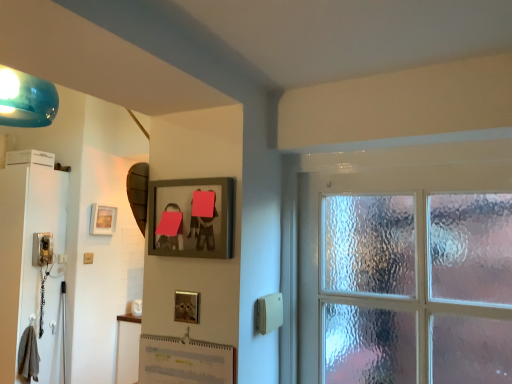
Question: Can you confirm if matte black phone at left is positioned to the left of matte white light switch at lower left?

Choices:
 (A) yes
 (B) no

Answer: (A)

Question: Does matte black phone at left have a smaller size compared to matte white light switch at lower left?

Choices:
 (A) yes
 (B) no

Answer: (B)

Question: From the image's perspective, is matte black phone at left over matte white light switch at lower left?

Choices:
 (A) yes
 (B) no

Answer: (A)

Question: Is matte black phone at left outside matte white light switch at lower left?

Choices:
 (A) no
 (B) yes

Answer: (B)

Question: Can you confirm if matte black phone at left is shorter than matte white light switch at lower left?

Choices:
 (A) no
 (B) yes

Answer: (A)

Question: Is matte black phone at left bigger than matte white light switch at lower left?

Choices:
 (A) yes
 (B) no

Answer: (A)

Question: Is matte black phone at left thinner than matte gold picture frame at upper left, which ranks as the second picture frame in front-to-back order?

Choices:
 (A) yes
 (B) no

Answer: (B)

Question: From a real-world perspective, does matte black phone at left sit lower than matte gold picture frame at upper left, arranged as the 1th picture frame when viewed from the back?

Choices:
 (A) yes
 (B) no

Answer: (A)

Question: Is matte gold picture frame at upper left, which appears as the second picture frame when viewed from the right, at the back of matte black phone at left?

Choices:
 (A) yes
 (B) no

Answer: (B)

Question: Is matte black phone at left aimed at matte gold picture frame at upper left, positioned as the first picture frame in left-to-right order?

Choices:
 (A) no
 (B) yes

Answer: (A)

Question: Can you confirm if matte black phone at left is positioned to the right of matte gold picture frame at upper left, positioned as the first picture frame in left-to-right order?

Choices:
 (A) yes
 (B) no

Answer: (B)

Question: Is matte black phone at left taller than matte gold picture frame at upper left, positioned as the first picture frame in left-to-right order?

Choices:
 (A) yes
 (B) no

Answer: (B)

Question: Is matte white light switch at lower left shorter than matte gold picture frame at upper left, arranged as the 1th picture frame when viewed from the back?

Choices:
 (A) yes
 (B) no

Answer: (A)